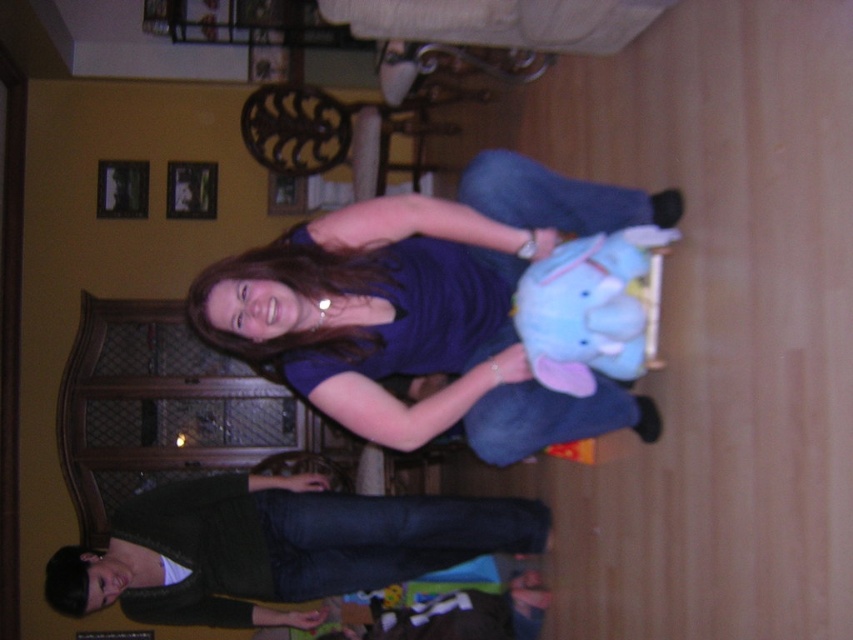
You are trying to determine if the soft blue plush elephant at center can be placed on a shelf that is currently at the height of the dark blue jeans at lower center. Can the elephant fit without needing to adjust the shelf height?

The dark blue jeans at lower center is taller than the soft blue plush elephant at center, so the shelf at the height of the dark blue jeans at lower center is higher than the elephant. Therefore, the soft blue plush elephant at center can be placed on the shelf without needing to adjust the shelf height.

You are a photographer adjusting your camera settings to capture the scene. You notice the matte blue dress at center and the dark blue jeans at lower center. Which object should you focus on first if you want to ensure both are in sharp focus?

Since the matte blue dress at center is located above the dark blue jeans at lower center, you should focus on the matte blue dress at center first to ensure both are in sharp focus as they are vertically aligned.